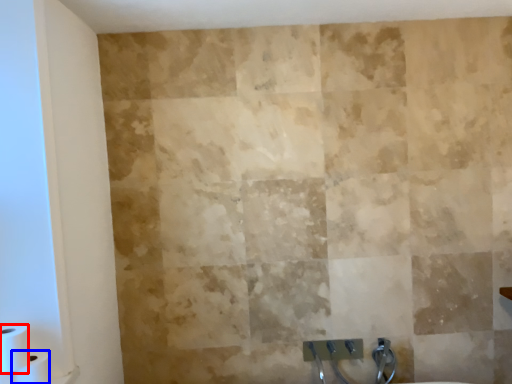
Question: Which object is further to the camera taking this photo, toilet paper (highlighted by a red box) or toilet paper (highlighted by a blue box)?

Choices:
 (A) toilet paper
 (B) toilet paper

Answer: (B)